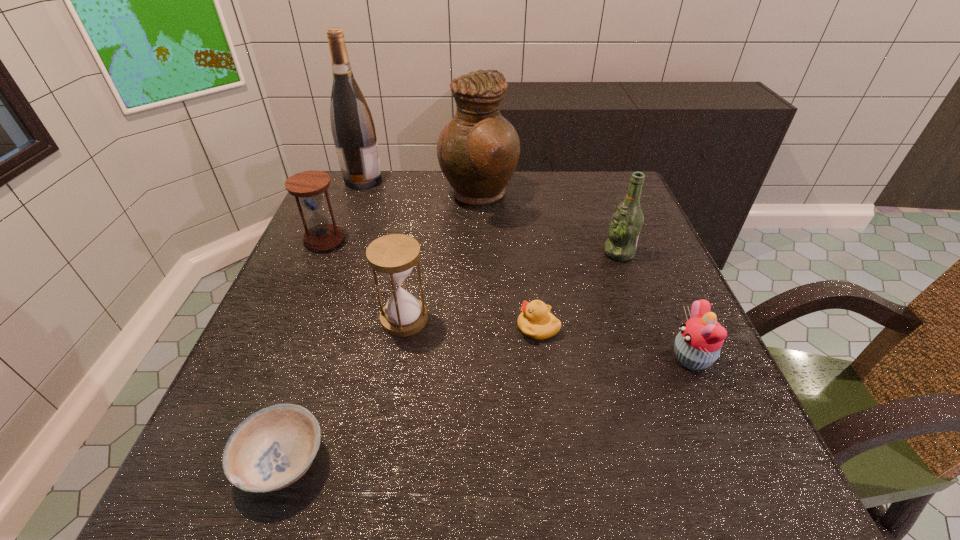
At what (x,y) coordinates should I click in order to perform the action: click on cupcake at the right edge. Please return your answer as a coordinate pair (x, y). Looking at the image, I should click on (697, 346).

You are a GUI agent. You are given a task and a screenshot of the screen. Output one action in this format:
    pyautogui.click(x=<x>, y=<y>)
    Task: Click on the object that is at the far left corner
    
    Given the screenshot: What is the action you would take?
    pyautogui.click(x=352, y=126)

In order to click on object that is at the near left corner in this screenshot , I will do `click(271, 449)`.

This screenshot has width=960, height=540. Find the location of `vacant position at the far edge of the desktop`. vacant position at the far edge of the desktop is located at coordinates (555, 187).

In order to click on vacant region at the near edge in this screenshot , I will do `click(521, 478)`.

Identify the location of vacant area at the left edge. (222, 413).

Find the location of a particular element. free location at the right edge of the desktop is located at coordinates (629, 284).

Locate an element on the screen. This screenshot has height=540, width=960. free location at the far left corner is located at coordinates (389, 181).

At what (x,y) coordinates should I click in order to perform the action: click on vacant space at the near left corner of the desktop. Please return your answer as a coordinate pair (x, y). Looking at the image, I should click on (213, 462).

You are a GUI agent. You are given a task and a screenshot of the screen. Output one action in this format:
    pyautogui.click(x=<x>, y=<y>)
    Task: Click on the free space between the farther hourglass and the wine bottle
    
    Given the screenshot: What is the action you would take?
    pyautogui.click(x=344, y=210)